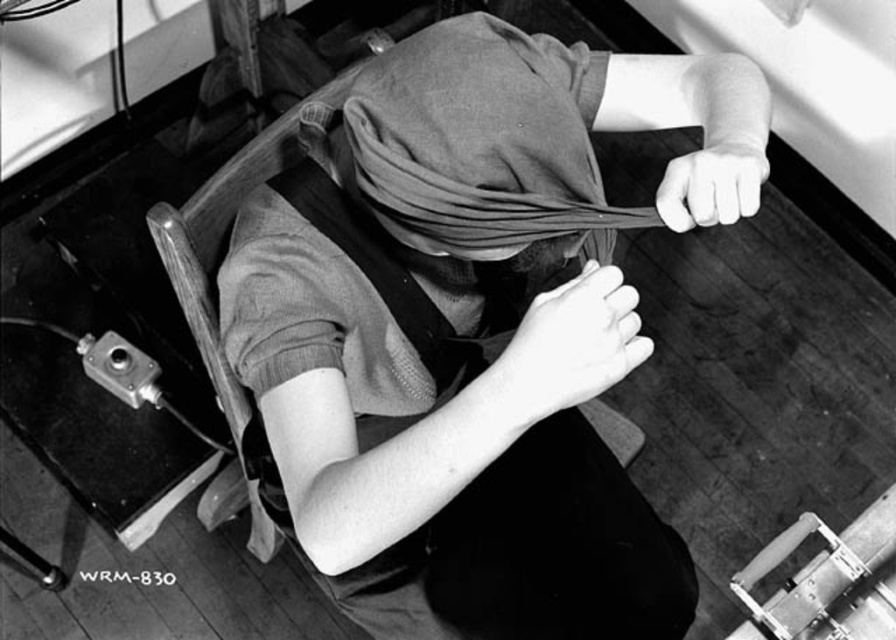
Which is more to the left, matte fabric head covering at center or black leather strap at center?

black leather strap at center is more to the left.

The width and height of the screenshot is (896, 640). Describe the element at coordinates (462, 346) in the screenshot. I see `matte fabric head covering at center` at that location.

The height and width of the screenshot is (640, 896). I want to click on matte fabric head covering at center, so [462, 346].

Looking at this image, does matte fabric head covering at center lie in front of white matte hand at upper right?

Yes, matte fabric head covering at center is closer to the viewer.

What do you see at coordinates (462, 346) in the screenshot? I see `matte fabric head covering at center` at bounding box center [462, 346].

Between point (455, 504) and point (685, 202), which one is positioned behind?

Positioned behind is point (455, 504).

Identify the location of matte fabric head covering at center. This screenshot has width=896, height=640. (462, 346).

Is smooth skin hand at center taller than white matte hand at upper right?

Yes.

Does smooth skin hand at center have a greater width compared to white matte hand at upper right?

Indeed, smooth skin hand at center has a greater width compared to white matte hand at upper right.

Who is more distant from viewer, (x=526, y=346) or (x=738, y=156)?

The point (x=738, y=156) is behind.

This screenshot has width=896, height=640. What are the coordinates of `smooth skin hand at center` in the screenshot? It's located at (571, 344).